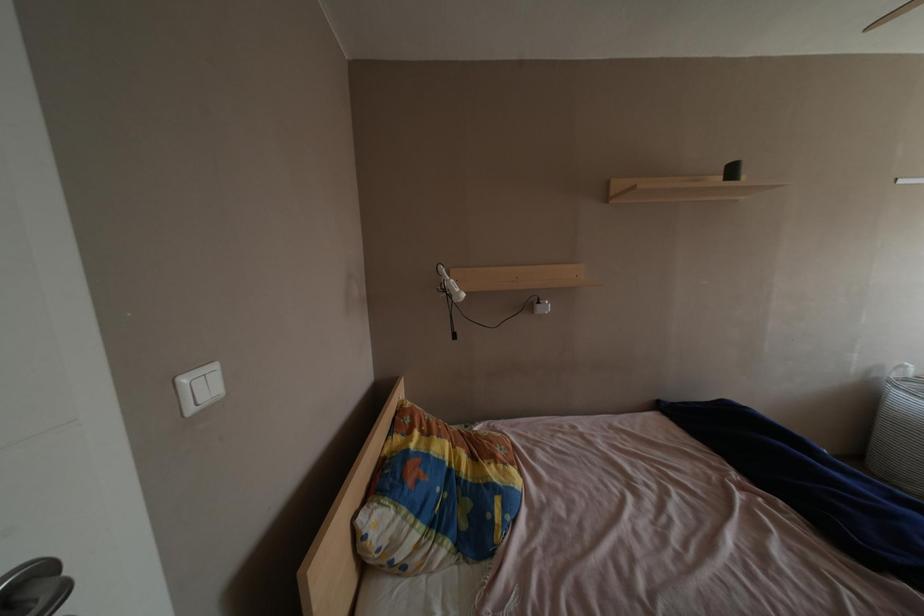
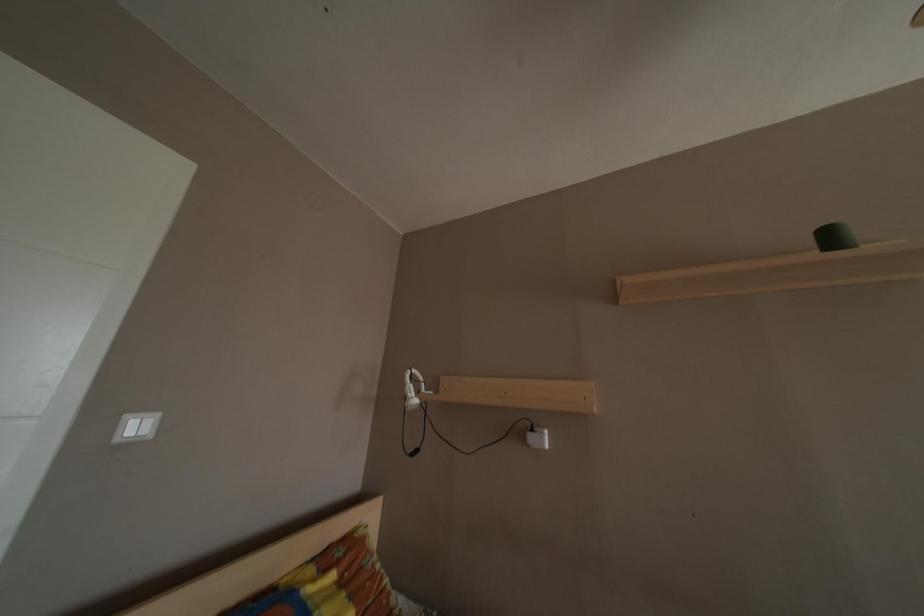
From the picture: The images are taken continuously from a first-person perspective. In which direction is your viewpoint rotating?

The camera rotated toward left-up.